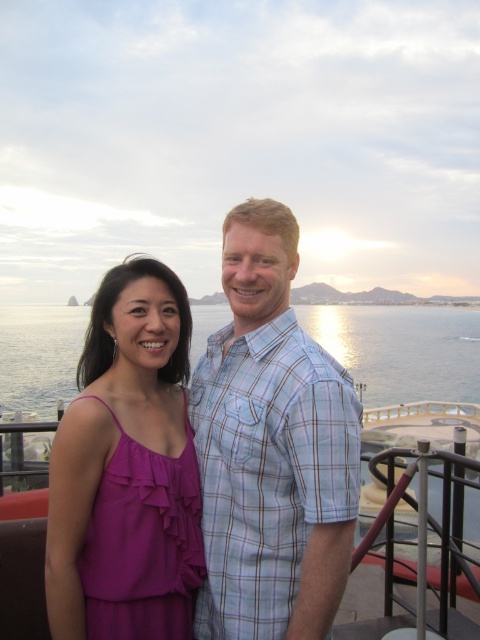
Does light blue plaid shirt at center appear on the left side of blue water at center?

Incorrect, light blue plaid shirt at center is not on the left side of blue water at center.

Is light blue plaid shirt at center taller than blue water at center?

In fact, light blue plaid shirt at center may be shorter than blue water at center.

What do you see at coordinates (271, 449) in the screenshot? I see `light blue plaid shirt at center` at bounding box center [271, 449].

Identify the location of light blue plaid shirt at center. This screenshot has width=480, height=640. (271, 449).

Between purple chiffon dress at center and blue water at center, which one has more height?

blue water at center

You are a GUI agent. You are given a task and a screenshot of the screen. Output one action in this format:
    pyautogui.click(x=<x>, y=<y>)
    Task: Click on the purple chiffon dress at center
    
    Given the screenshot: What is the action you would take?
    pyautogui.click(x=127, y=468)

Who is positioned more to the left, light blue plaid shirt at center or purple chiffon dress at center?

purple chiffon dress at center is more to the left.

Is point (213, 372) farther from viewer compared to point (164, 472)?

Yes.

At what (x,y) coordinates should I click in order to perform the action: click on light blue plaid shirt at center. Please return your answer as a coordinate pair (x, y). The width and height of the screenshot is (480, 640). Looking at the image, I should click on (271, 449).